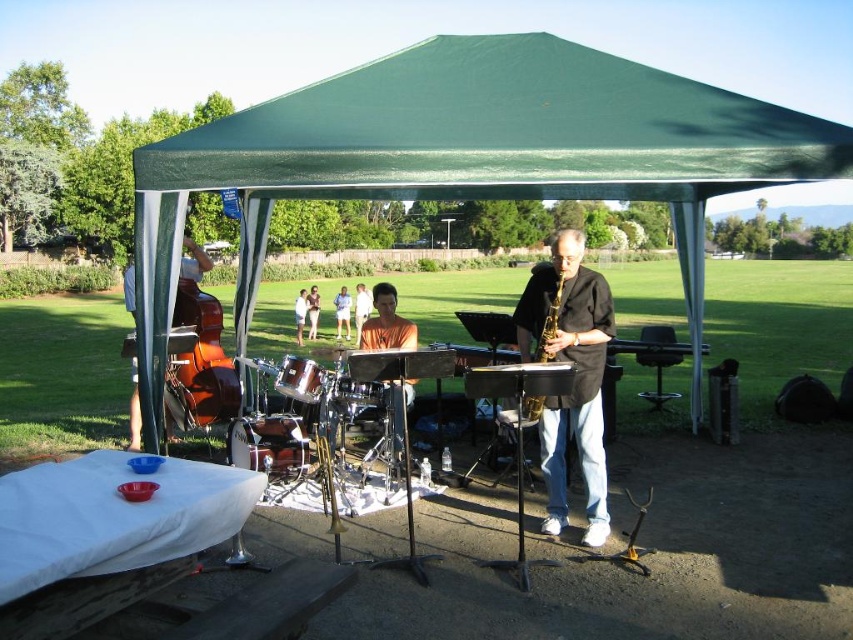
Question: Which point is closer to the camera?

Choices:
 (A) green fabric tent at center
 (B) gold shiny saxophone at center
 (C) green fabric canopy at upper center
 (D) shiny brown cello at left

Answer: (A)

Question: Does green fabric canopy at upper center appear on the right side of smooth brown leather jacket at center?

Choices:
 (A) yes
 (B) no

Answer: (A)

Question: Which point is closer to the camera taking this photo?

Choices:
 (A) (273, 188)
 (B) (384, 324)
 (C) (343, 310)
 (D) (540, 404)

Answer: (D)

Question: Based on their relative distances, which object is farther from the orange fabric at center?

Choices:
 (A) gold metallic saxophone at center
 (B) smooth brown leather jacket at center
 (C) green fabric tent at center

Answer: (B)

Question: Is green fabric canopy at upper center to the left of smooth brown leather jacket at center from the viewer's perspective?

Choices:
 (A) no
 (B) yes

Answer: (A)

Question: Can you confirm if orange fabric at center is positioned below orange fabric pants at center?

Choices:
 (A) no
 (B) yes

Answer: (B)